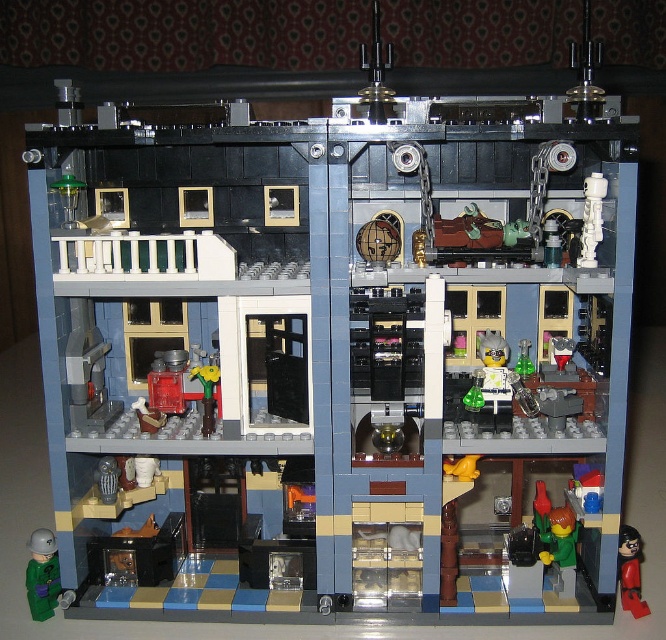
You are a visitor standing at the entrance of the LEGO building. You see the green matte figure at lower left and the point marked at coordinate (43, 573). Which object is closer to you?

The point marked at coordinate (43, 573) corresponds to the green matte figure at lower left, so they are the same object.

You are a visitor approaching the LEGO building and see the green matte figure at lower left and the shiny black figure at lower right. Which figure is positioned higher up in the building?

The green matte figure at lower left is located above the shiny black figure at lower right, so it is positioned higher up in the building.

You are examining the LEGO model and notice two points marked on it. Which of the two points, point 1 at coordinates (x=47, y=552) or point 2 at coordinates (x=627, y=557), is closer to your viewpoint?

Point 1 at coordinates (x=47, y=552) is closer to your viewpoint than point 2 at coordinates (x=627, y=557).